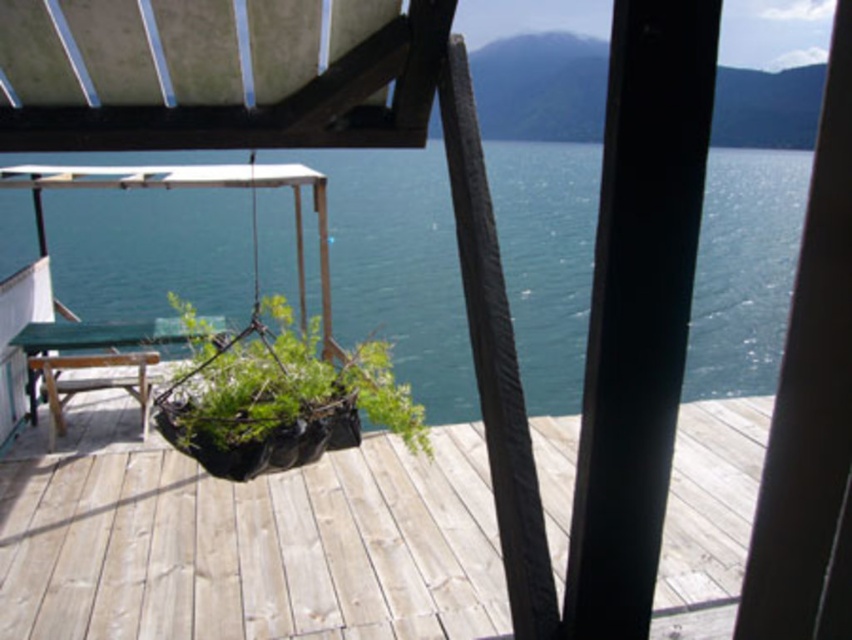
Who is taller, blue water at center or black fabric plant at center?

blue water at center is taller.

Is blue water at center to the left of black fabric plant at center from the viewer's perspective?

In fact, blue water at center is to the right of black fabric plant at center.

Which is in front, point (136, 196) or point (303, 445)?

Positioned in front is point (303, 445).

This screenshot has height=640, width=852. Identify the location of blue water at center. (399, 268).

Can you confirm if wooden at center is positioned to the right of black fabric plant at center?

No, wooden at center is not to the right of black fabric plant at center.

Does wooden at center come behind black fabric plant at center?

That is True.

Does point (49, 509) come closer to viewer compared to point (228, 436)?

No, (49, 509) is behind (228, 436).

The height and width of the screenshot is (640, 852). Find the location of `wooden at center`. wooden at center is located at coordinates (245, 540).

Between point (288, 540) and point (444, 278), which one is positioned in front?

Point (288, 540)

The height and width of the screenshot is (640, 852). What do you see at coordinates (245, 540) in the screenshot? I see `wooden at center` at bounding box center [245, 540].

Locate an element on the screen. wooden at center is located at coordinates (245, 540).